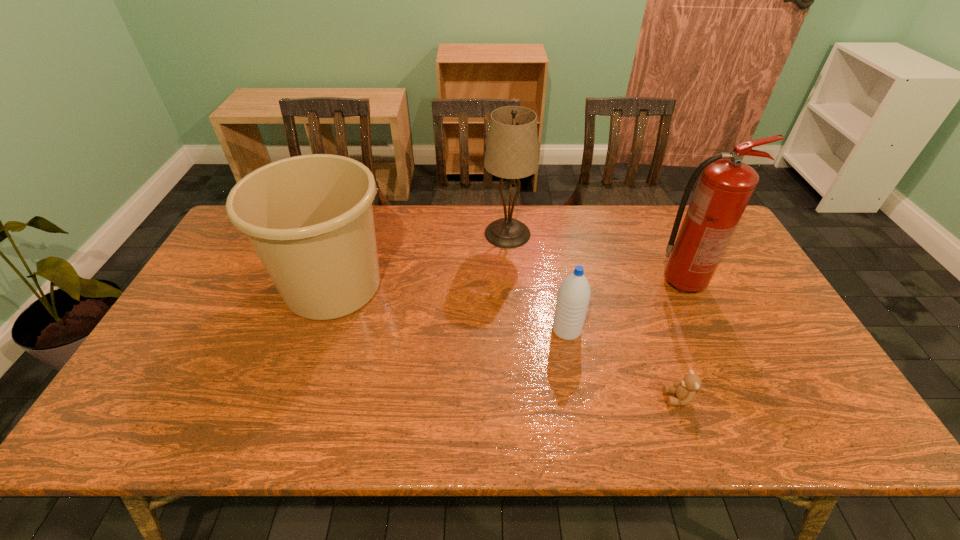
Image resolution: width=960 pixels, height=540 pixels. I want to click on vacant space located 0.340m on the front-facing side of the lampshade, so click(381, 234).

This screenshot has height=540, width=960. Identify the location of free space located on the front-facing side of the lampshade. (414, 234).

Where is `vacant space positioned on the front of the bucket`? vacant space positioned on the front of the bucket is located at coordinates (306, 361).

Identify the location of vacant space located on the right of the third object from left to right. The width and height of the screenshot is (960, 540). (699, 330).

Image resolution: width=960 pixels, height=540 pixels. I want to click on vacant space located on the front-facing side of the teddy bear, so click(630, 399).

Find the location of a particular element. The height and width of the screenshot is (540, 960). vacant position located on the front-facing side of the teddy bear is located at coordinates (505, 399).

Where is `vacant space situated 0.370m on the front-facing side of the teddy bear`? vacant space situated 0.370m on the front-facing side of the teddy bear is located at coordinates (505, 399).

Find the location of a particular element. Image resolution: width=960 pixels, height=540 pixels. lampshade positioned at the far edge is located at coordinates (511, 152).

At what (x,y) coordinates should I click in order to perform the action: click on bucket at the far edge. Please return your answer as a coordinate pair (x, y). The width and height of the screenshot is (960, 540). Looking at the image, I should click on (309, 218).

You are a GUI agent. You are given a task and a screenshot of the screen. Output one action in this format:
    pyautogui.click(x=<x>, y=<y>)
    Task: Click on the object present at the near edge
    
    Given the screenshot: What is the action you would take?
    pyautogui.click(x=685, y=390)